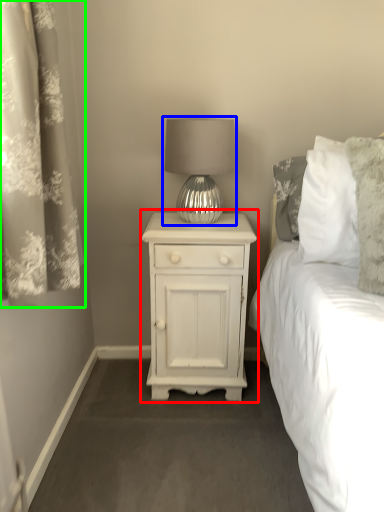
Question: Considering the real-world distances, which object is farthest from nightstand (highlighted by a red box)? lamp (highlighted by a blue box) or curtain (highlighted by a green box)?

Choices:
 (A) lamp
 (B) curtain

Answer: (B)